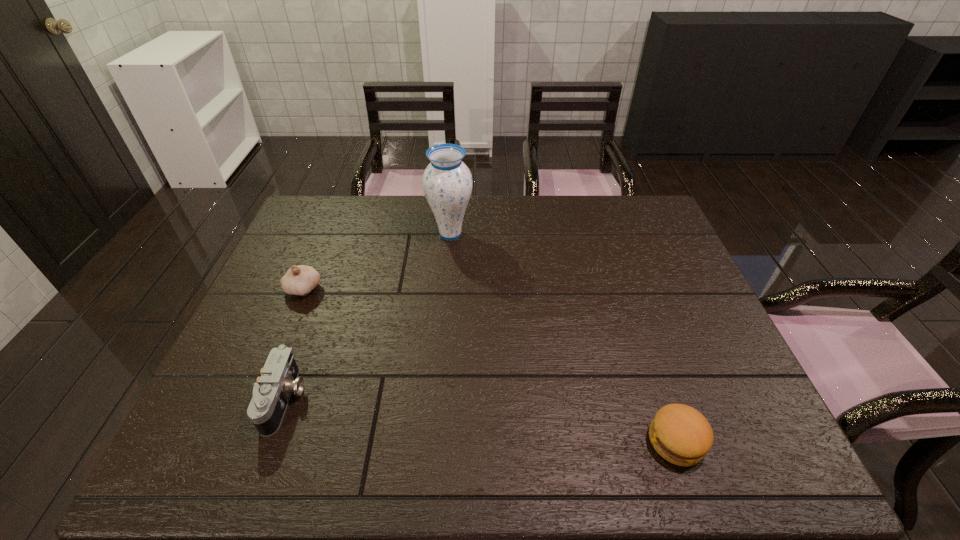
In the image, there is a desktop. Where is `vacant area at the near left corner`? The width and height of the screenshot is (960, 540). vacant area at the near left corner is located at coordinates [x=188, y=440].

The height and width of the screenshot is (540, 960). Identify the location of free space at the far right corner. (647, 203).

Where is `vacant region between the camera and the garlic`? This screenshot has width=960, height=540. vacant region between the camera and the garlic is located at coordinates (294, 344).

Locate an element on the screen. The image size is (960, 540). free space between the hamburger and the second farthest object is located at coordinates (490, 365).

Where is `empty space that is in between the third object from left to right and the hamburger`? Image resolution: width=960 pixels, height=540 pixels. empty space that is in between the third object from left to right and the hamburger is located at coordinates (564, 338).

Locate an element on the screen. free spot between the rightmost object and the tallest object is located at coordinates (564, 338).

The image size is (960, 540). Identify the location of free spot between the second farthest object and the camera. (294, 344).

I want to click on empty space that is in between the rightmost object and the second farthest object, so click(490, 365).

I want to click on vacant area between the camera and the rightmost object, so click(x=480, y=420).

At what (x,y) coordinates should I click in order to perform the action: click on vacant space in between the rightmost object and the second farthest object. Please return your answer as a coordinate pair (x, y). The height and width of the screenshot is (540, 960). Looking at the image, I should click on (490, 365).